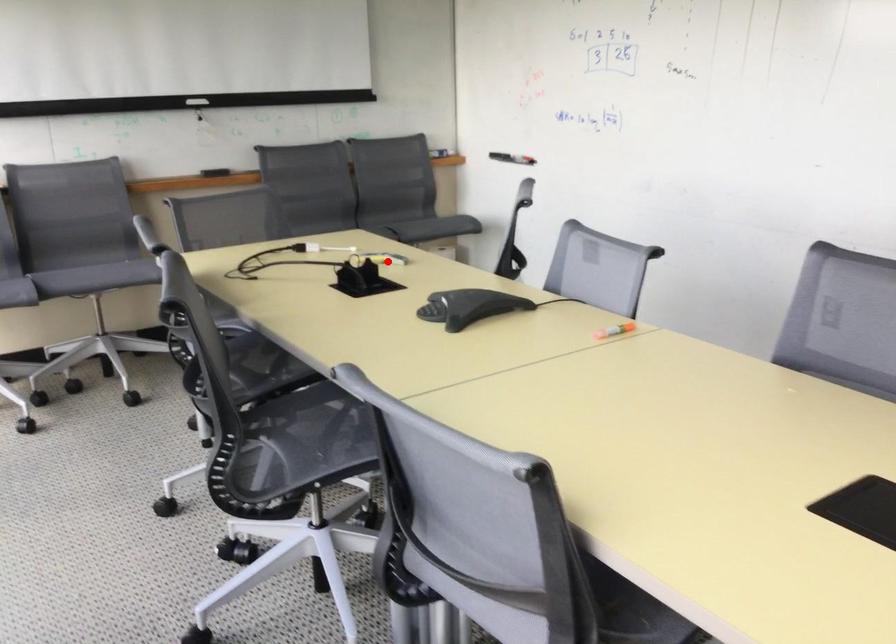
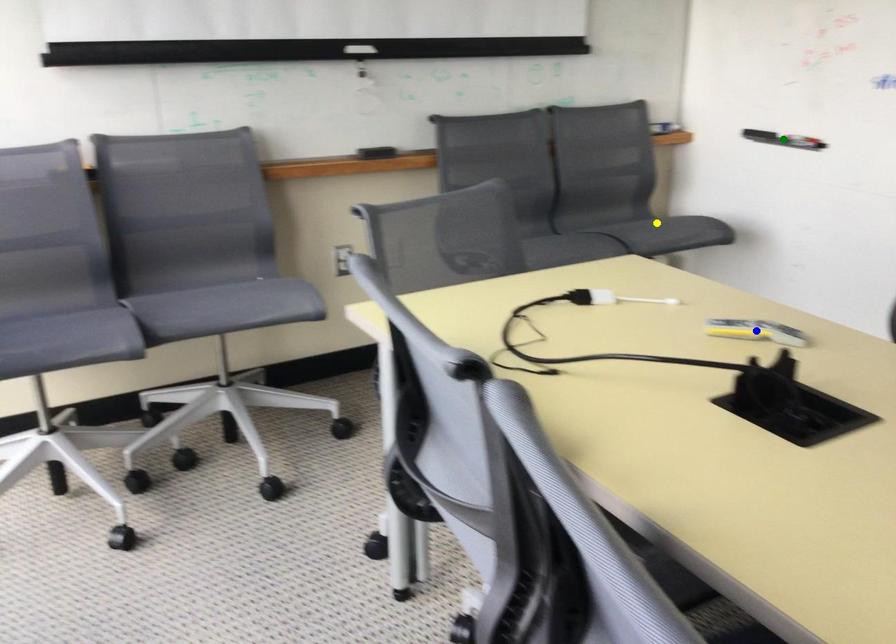
Question: I am providing you with two images of the same scene from different viewpoints. A red point is marked on the first image. You are given multiple points on the second image. Which mark in image 2 goes with the point in image 1?

Choices:
 (A) green point
 (B) blue point
 (C) yellow point

Answer: (B)